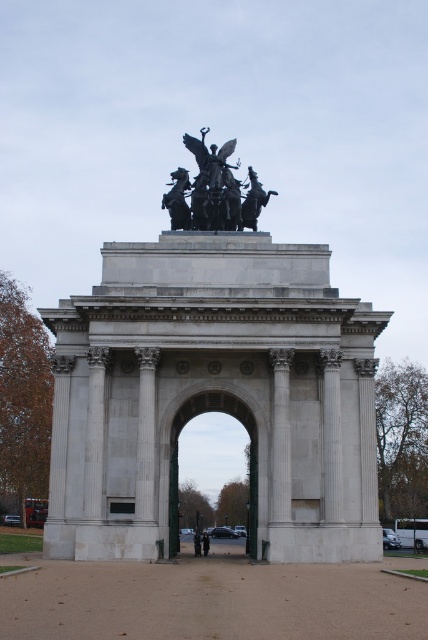
You are an architect evaluating the proportions of the white stone arch at center and the polished bronze statue at upper center in the image. Which object is larger in size?

The white stone arch at center is bigger than the polished bronze statue at upper center, so the white stone arch at center is larger in size.

Based on the scene described, where is the white stone arch at center located in relation to the polished bronze statue at upper center?

The white stone arch at center is located to the right of the polished bronze statue at upper center.